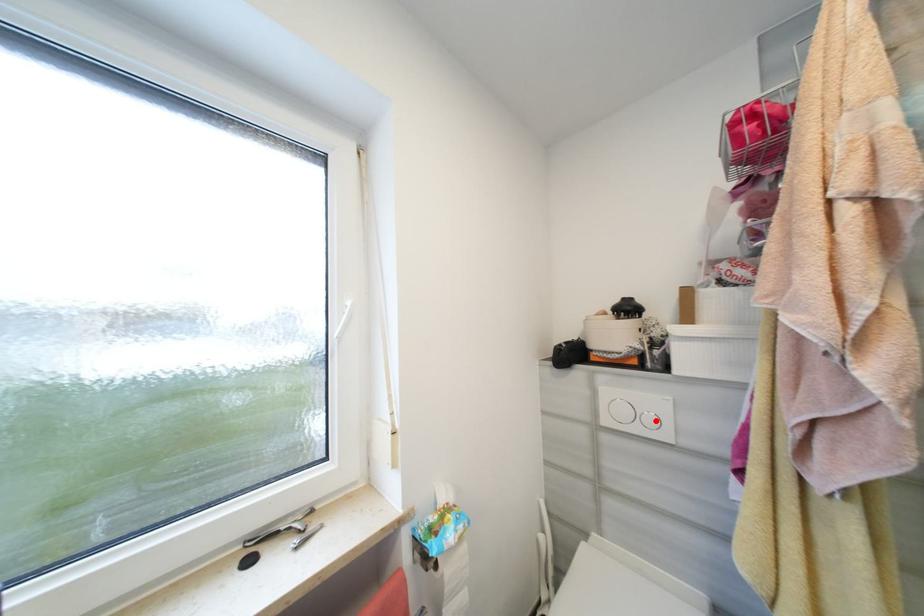
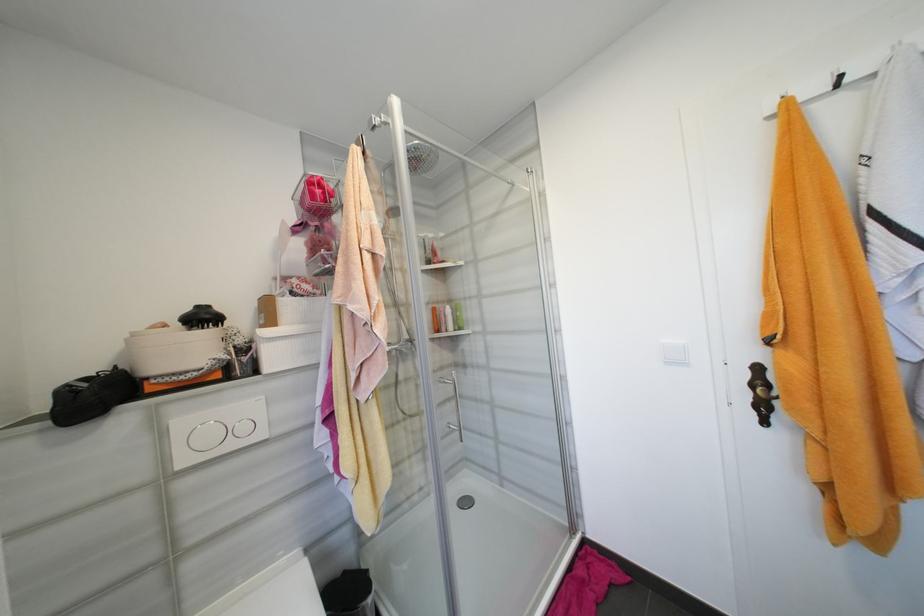
Find the pixel in the second image that matches the highlighted location in the first image.

(249, 429)